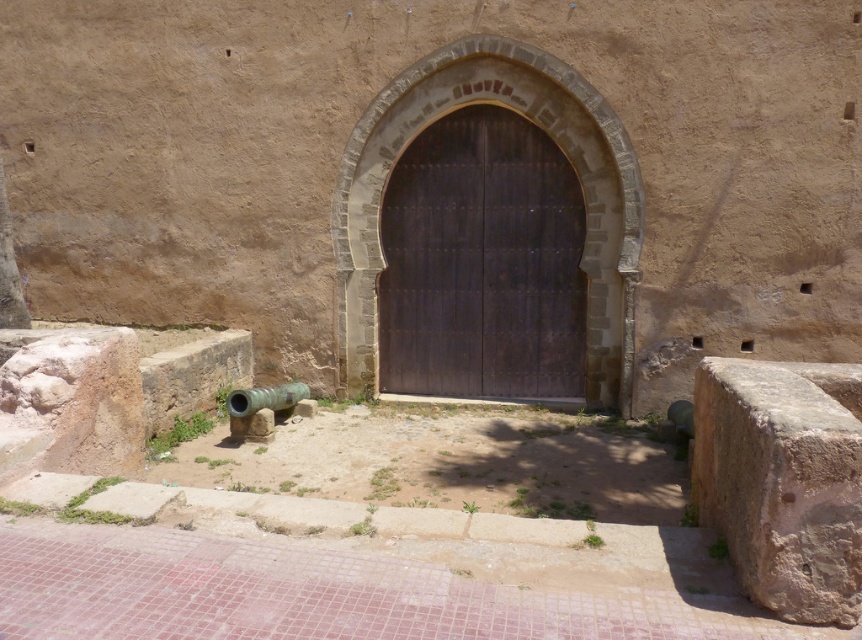
Can you confirm if dark wood door at center is wider than brown rough stone at lower right?

Indeed, dark wood door at center has a greater width compared to brown rough stone at lower right.

Is the position of dark wood door at center more distant than that of brown rough stone at lower right?

Yes, it is behind brown rough stone at lower right.

You are a GUI agent. You are given a task and a screenshot of the screen. Output one action in this format:
    pyautogui.click(x=<x>, y=<y>)
    Task: Click on the dark wood door at center
    This screenshot has height=640, width=862.
    Given the screenshot: What is the action you would take?
    pyautogui.click(x=482, y=262)

Between brown rough stone at lower right and green polished metal cannon at lower left, which one has less height?

Standing shorter between the two is green polished metal cannon at lower left.

Where is `brown rough stone at lower right`? brown rough stone at lower right is located at coordinates (784, 481).

Does point (784, 593) come farther from viewer compared to point (240, 417)?

That is False.

Find the location of a particular element. brown rough stone at lower right is located at coordinates [784, 481].

Between dark wood door at center and green polished metal cannon at lower left, which one appears on the left side from the viewer's perspective?

green polished metal cannon at lower left is more to the left.

Is dark wood door at center above green polished metal cannon at lower left?

Yes, dark wood door at center is above green polished metal cannon at lower left.

Between point (433, 371) and point (247, 392), which one is positioned behind?

Positioned behind is point (433, 371).

The width and height of the screenshot is (862, 640). Find the location of `dark wood door at center`. dark wood door at center is located at coordinates (482, 262).